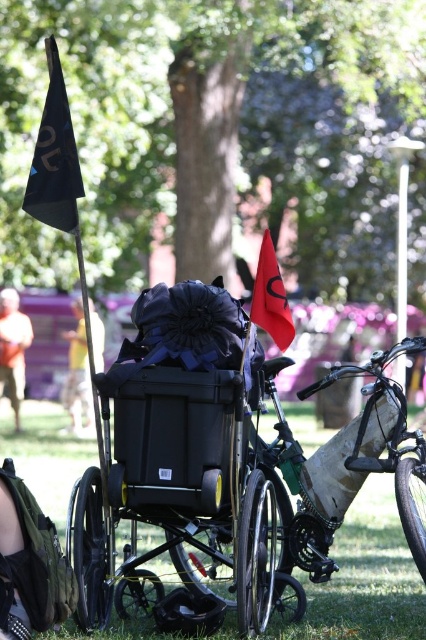
Between point (262, 328) and point (16, 376), which one is positioned in front?

Positioned in front is point (262, 328).

Describe the element at coordinates (270, 298) in the screenshot. I see `red fabric flag at center` at that location.

Find the location of a particular element. This screenshot has width=426, height=640. red fabric flag at center is located at coordinates (270, 298).

Which of these two, black matte wheelchair at center or black fabric flag at upper left, stands taller?

black matte wheelchair at center is taller.

Is point (181, 454) farther from camera compared to point (74, 204)?

Yes, point (181, 454) is behind point (74, 204).

Between point (154, 454) and point (54, 115), which one is positioned behind?

The point (54, 115) is behind.

Image resolution: width=426 pixels, height=640 pixels. Find the location of `black matte wheelchair at center`. black matte wheelchair at center is located at coordinates (181, 412).

Can you confirm if green grass at center is taller than red fabric flag at center?

Incorrect, green grass at center's height is not larger of red fabric flag at center's.

Image resolution: width=426 pixels, height=640 pixels. Identify the location of green grass at center. (365, 577).